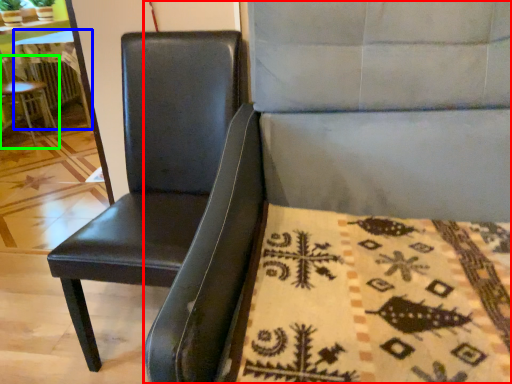
Question: Based on their relative distances, which object is nearer to chair (highlighted by a red box)? Choose from table (highlighted by a blue box) and chair (highlighted by a green box).

Choices:
 (A) table
 (B) chair

Answer: (B)